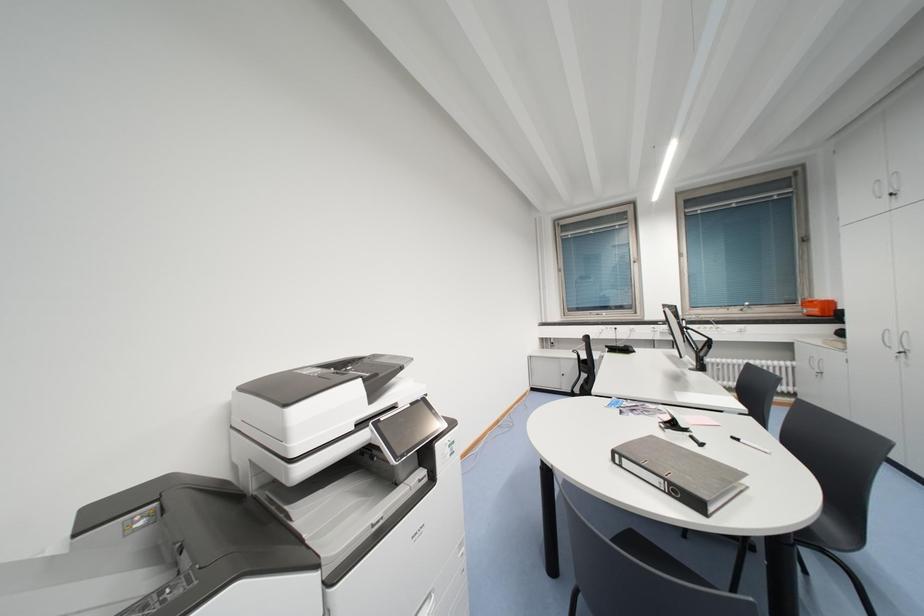
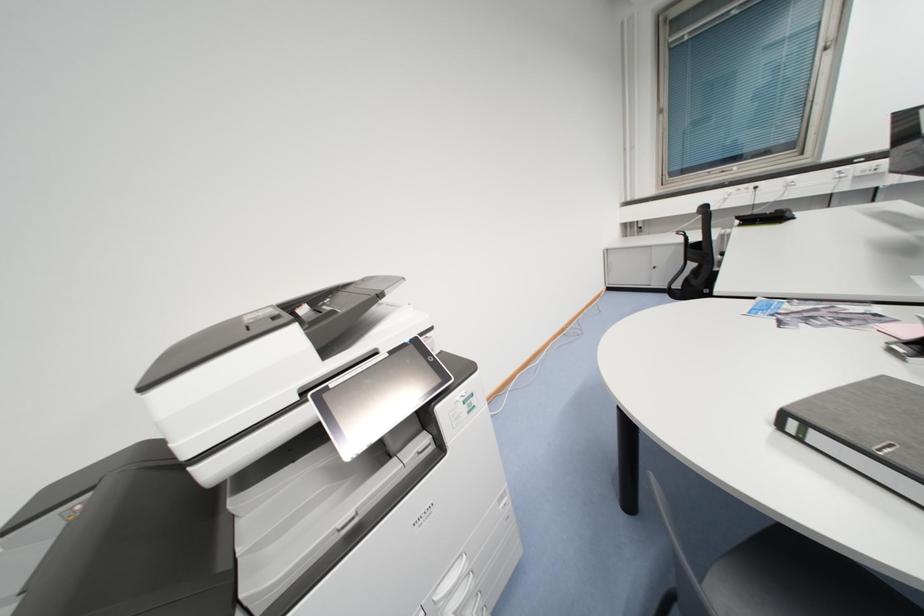
How did the camera likely rotate?

The rotation direction of the camera is left-down.